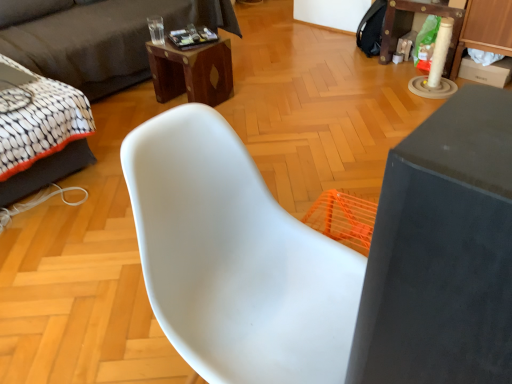
Find the location of a particular element. The image size is (512, 384). vacant area that is situated to the right of dark gray fabric couch at upper left is located at coordinates (307, 79).